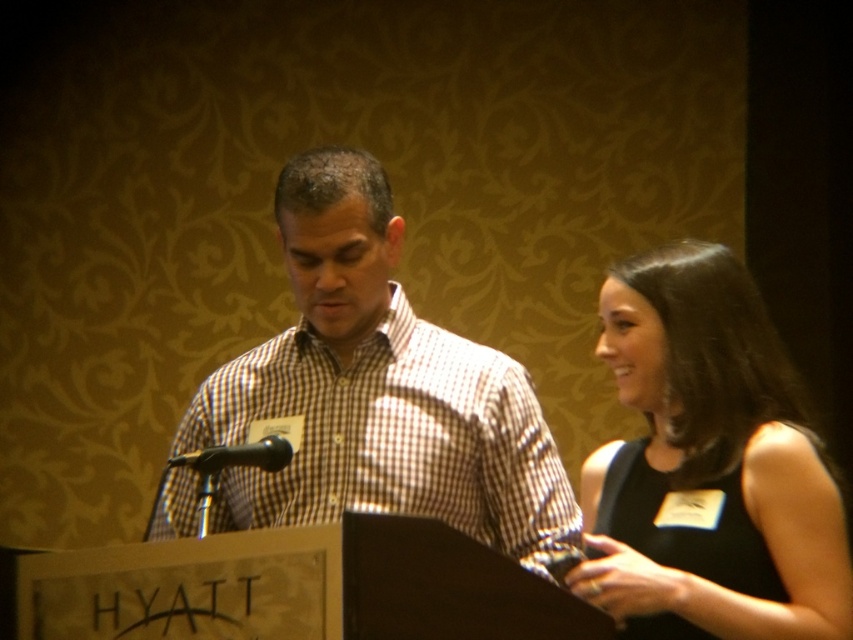
Question: Does white checkered shirt at center have a lesser width compared to black satin dress at right?

Choices:
 (A) no
 (B) yes

Answer: (A)

Question: Which of the following is the closest to the observer?

Choices:
 (A) black metallic microphone at center
 (B) white checkered shirt at center
 (C) black satin dress at right

Answer: (C)

Question: Which of these objects is positioned farthest from the black satin dress at right?

Choices:
 (A) white checkered shirt at center
 (B) black metallic microphone at center

Answer: (B)

Question: In this image, where is white checkered shirt at center located relative to black metallic microphone at center?

Choices:
 (A) above
 (B) below

Answer: (A)

Question: Is black satin dress at right smaller than black metallic microphone at center?

Choices:
 (A) no
 (B) yes

Answer: (A)

Question: Which object is the closest to the black metallic microphone at center?

Choices:
 (A) black satin dress at right
 (B) white checkered shirt at center

Answer: (B)